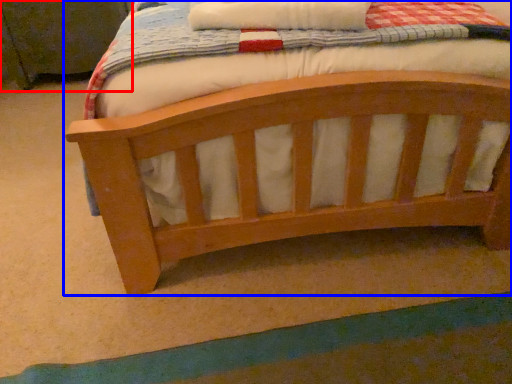
Question: Which point is closer to the camera, changing table (highlighted by a red box) or bed (highlighted by a blue box)?

Choices:
 (A) changing table
 (B) bed

Answer: (B)